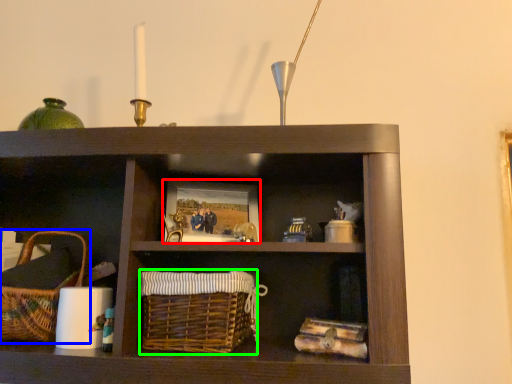
Question: Which object is the farthest from picture frame (highlighted by a red box)? Choose among these: picnic basket (highlighted by a blue box) or basket (highlighted by a green box).

Choices:
 (A) picnic basket
 (B) basket

Answer: (A)